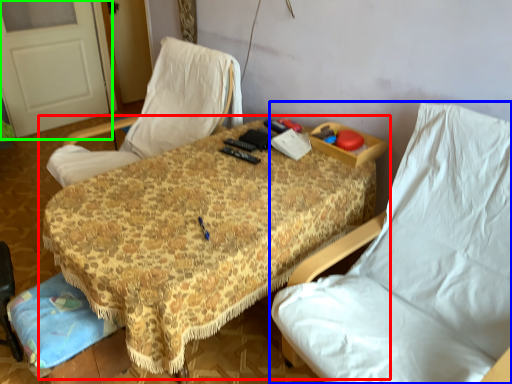
Question: Considering the real-world distances, which object is farthest from table (highlighted by a red box)? chair (highlighted by a blue box) or door (highlighted by a green box)?

Choices:
 (A) chair
 (B) door

Answer: (B)